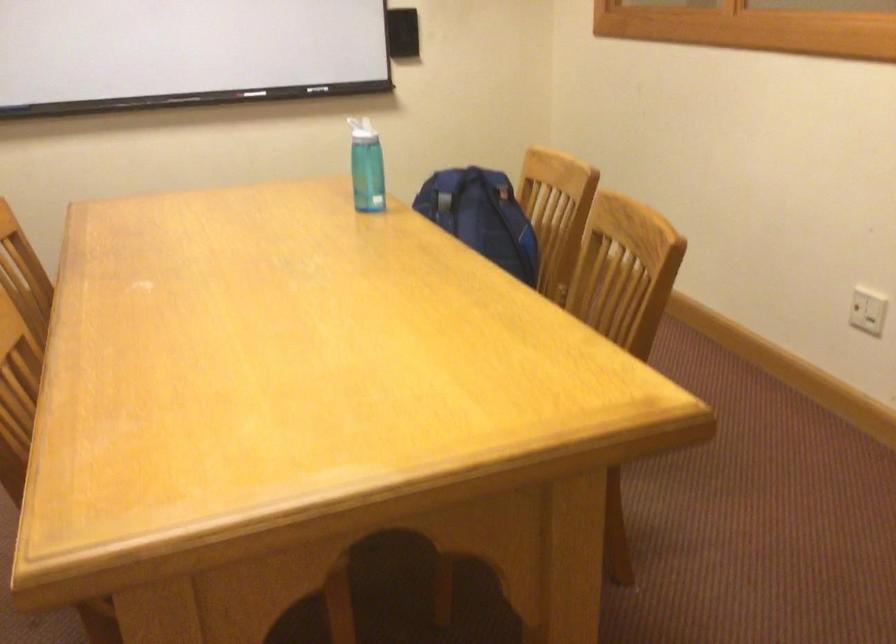
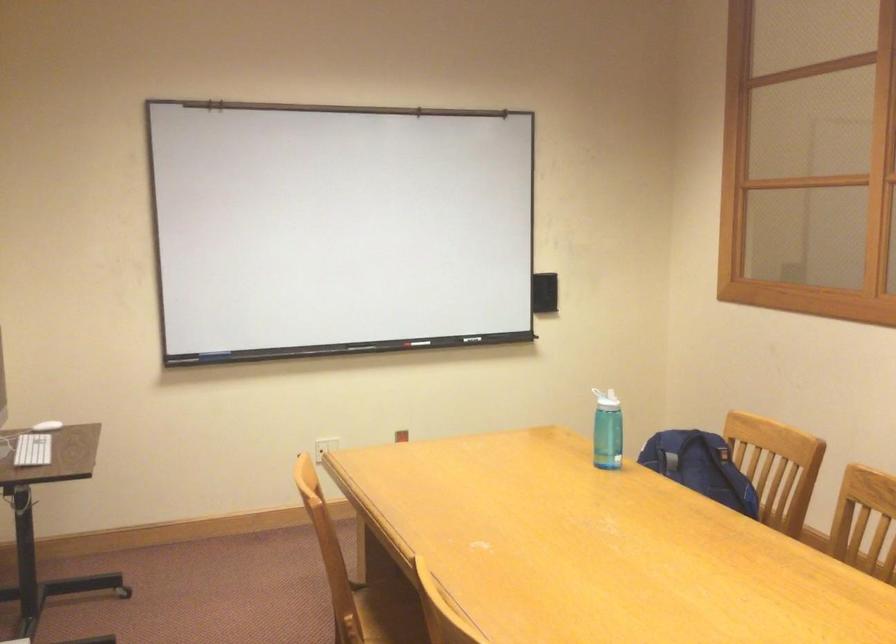
Find the pixel in the second image that matches [314,88] in the first image.

(476, 339)